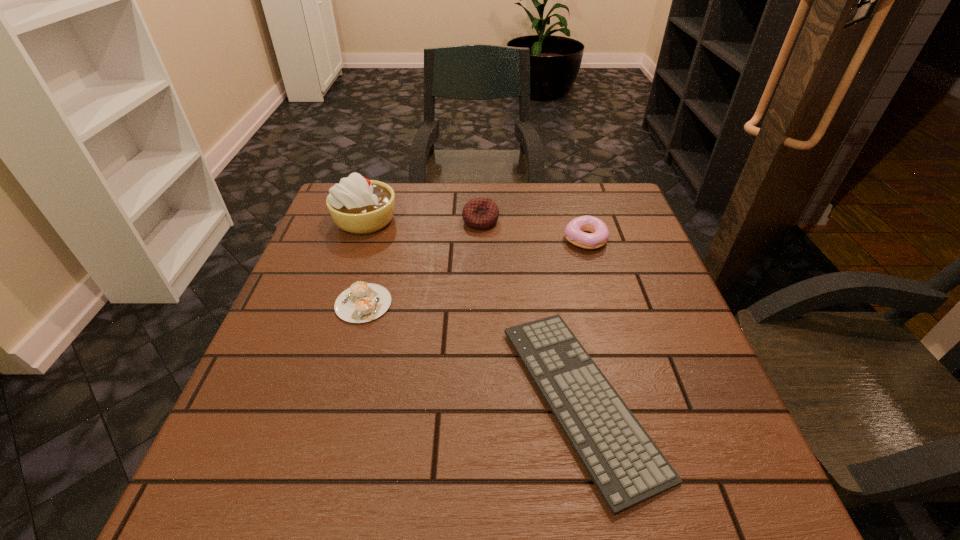
At what (x,y) coordinates should I click in order to perform the action: click on object positioned at the near right corner. Please return your answer as a coordinate pair (x, y). Looking at the image, I should click on (626, 466).

The image size is (960, 540). In the image, there is a desktop. What are the coordinates of `free space at the far edge` in the screenshot? It's located at (557, 203).

The height and width of the screenshot is (540, 960). In order to click on vacant region at the near edge of the desktop in this screenshot , I will do `click(335, 481)`.

This screenshot has height=540, width=960. Identify the location of vacant region at the left edge. (318, 340).

The height and width of the screenshot is (540, 960). Identify the location of vacant space at the right edge. (628, 258).

Find the location of a particular element. vacant point at the near left corner is located at coordinates (296, 482).

In the image, there is a desktop. What are the coordinates of `vacant space at the far right corner` in the screenshot? It's located at (608, 195).

The width and height of the screenshot is (960, 540). I want to click on free spot between the doughnut and the whipped cream, so click(475, 230).

Find the location of a particular element. This screenshot has width=960, height=540. blank region between the whipped cream and the beanbag is located at coordinates (423, 220).

Where is `unoccupied area between the cappuccino and the beanbag`? Image resolution: width=960 pixels, height=540 pixels. unoccupied area between the cappuccino and the beanbag is located at coordinates (422, 262).